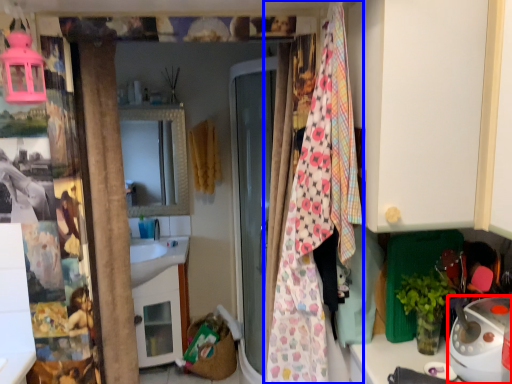
Question: Which of the following is the closest to the observer, appliance (highlighted by a red box) or blanket (highlighted by a blue box)?

Choices:
 (A) appliance
 (B) blanket

Answer: (B)